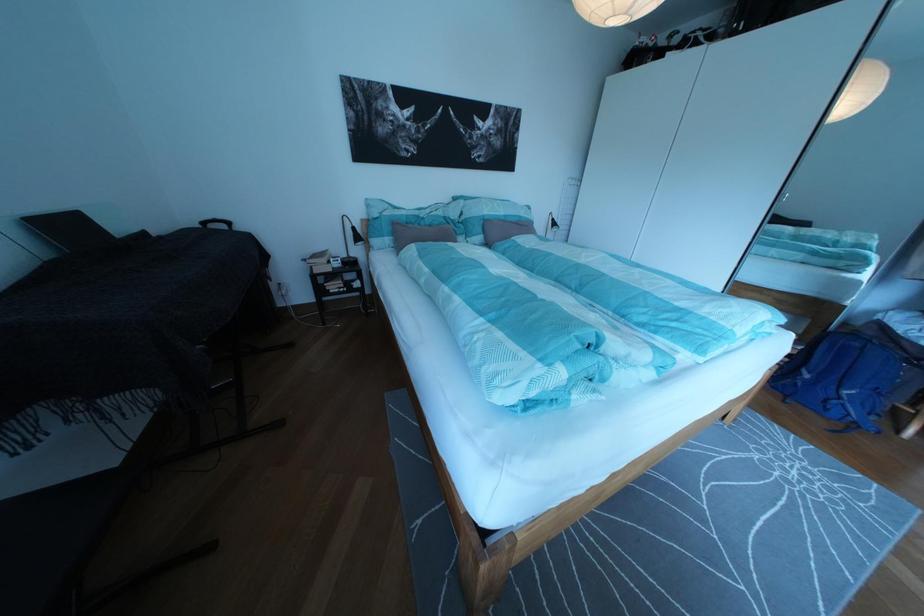
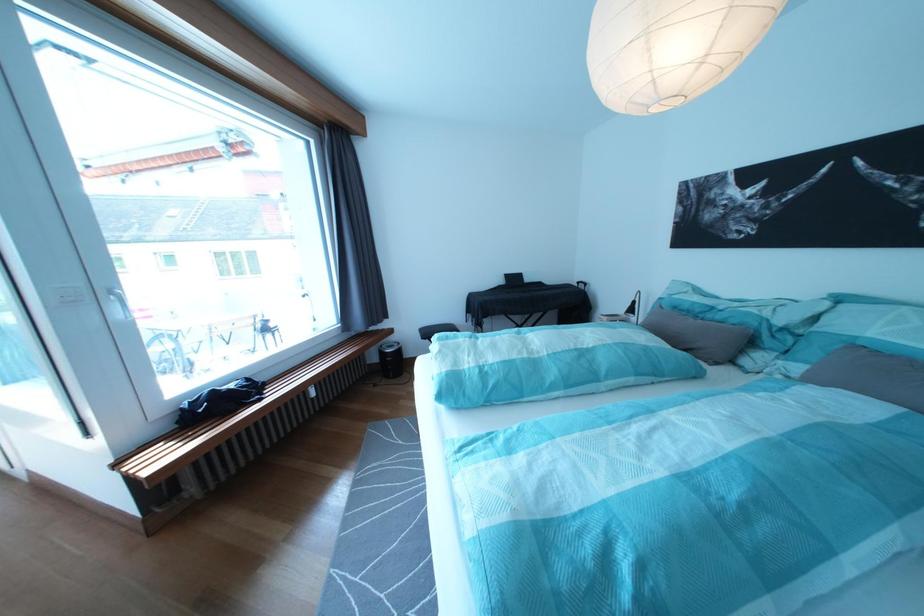
Find the pixel in the second image that matches (x=476, y=208) in the first image.

(841, 309)